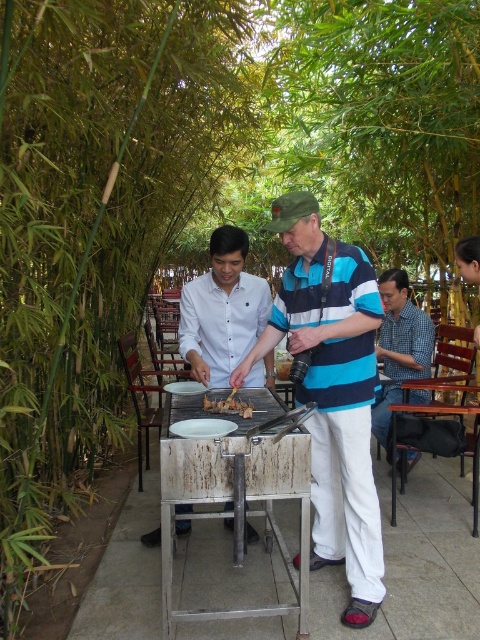
Who is more forward, (369,477) or (382,284)?

Positioned in front is point (369,477).

Which is more to the right, striped cotton shirt at center or blue checkered shirt at right?

From the viewer's perspective, blue checkered shirt at right appears more on the right side.

Identify the location of striped cotton shirt at center. (332, 390).

Locate an element on the screen. The height and width of the screenshot is (640, 480). striped cotton shirt at center is located at coordinates (332, 390).

Who is lower down, white matte shirt at center or blue checkered shirt at right?

blue checkered shirt at right

Can you confirm if white matte shirt at center is positioned to the right of blue checkered shirt at right?

No, white matte shirt at center is not to the right of blue checkered shirt at right.

Describe the element at coordinates (222, 310) in the screenshot. I see `white matte shirt at center` at that location.

Identify the location of white matte shirt at center. (x=222, y=310).

Does white matte shirt at center come behind golden crispy chicken at center?

Yes, it is behind golden crispy chicken at center.

The height and width of the screenshot is (640, 480). Find the location of `white matte shirt at center`. white matte shirt at center is located at coordinates (222, 310).